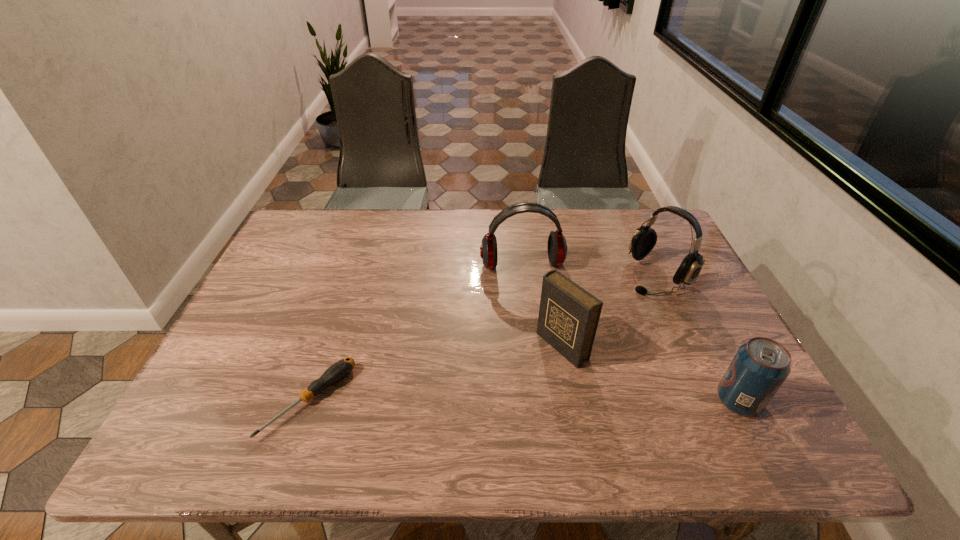
At what (x,y) coordinates should I click in order to perform the action: click on vacant space that satisfies the following two spatial constraints: 1. on the back side of the headset; 2. on the left side of the diary. Please return your answer as a coordinate pair (x, y). Looking at the image, I should click on click(549, 274).

Locate an element on the screen. This screenshot has width=960, height=540. vacant space that satisfies the following two spatial constraints: 1. on the back side of the headset; 2. on the left side of the screwdriver is located at coordinates (351, 274).

Find the location of a particular element. This screenshot has height=540, width=960. free spot that satisfies the following two spatial constraints: 1. on the front side of the fourth tallest object; 2. on the right side of the headset is located at coordinates (716, 401).

I want to click on vacant area that satisfies the following two spatial constraints: 1. on the front side of the diary; 2. on the left side of the pop soda, so click(572, 401).